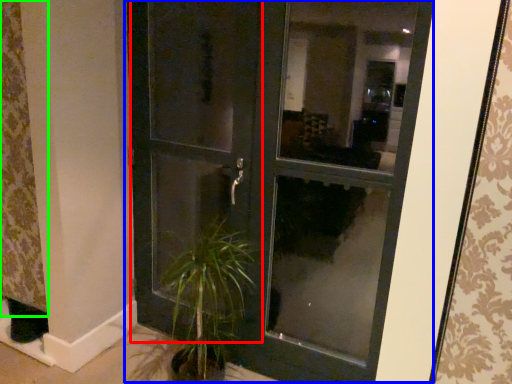
Question: Which object is the closest to the screen door (highlighted by a red box)? Choose among these: door (highlighted by a blue box) or curtain (highlighted by a green box).

Choices:
 (A) door
 (B) curtain

Answer: (A)